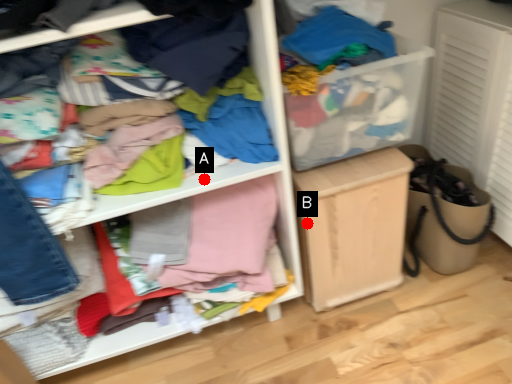
Question: Two points are circled on the image, labeled by A and B beside each circle. Which of the following is the farthest from the observer?

Choices:
 (A) A is further
 (B) B is further

Answer: (B)